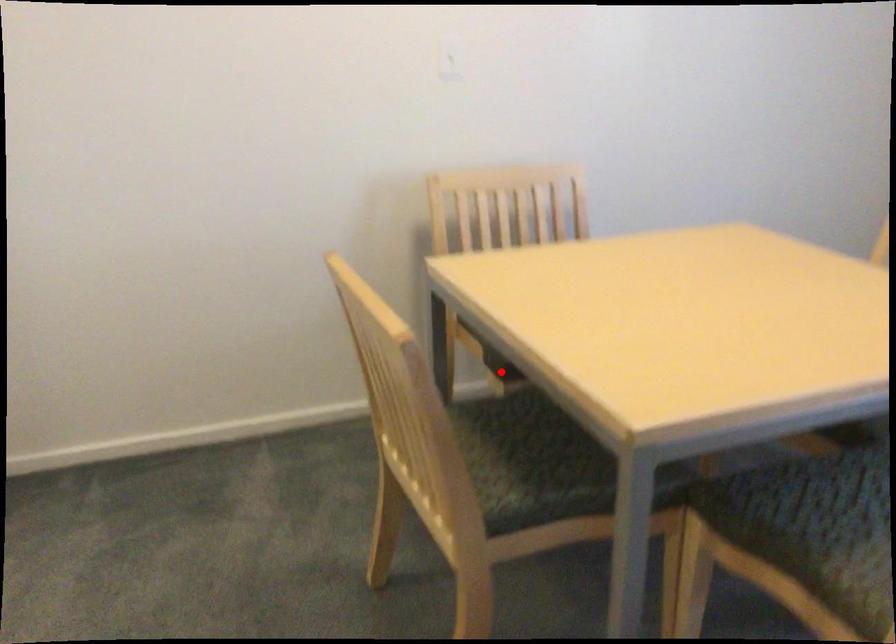
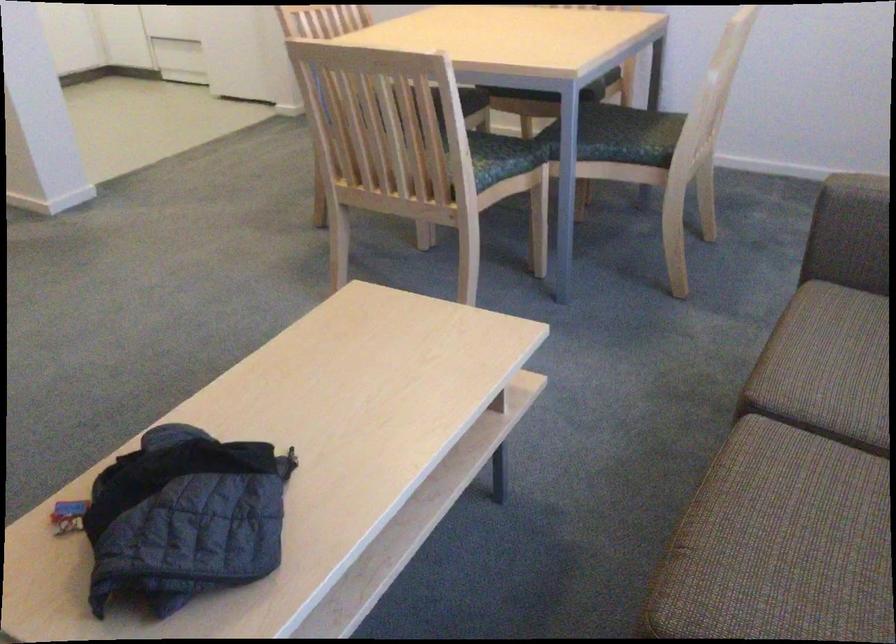
Question: I am providing you with two images of the same scene from different viewpoints. A red point is marked on the first image. At the location where the point appears in image 1, is it still visible in image 2?

Choices:
 (A) Yes
 (B) No

Answer: (B)